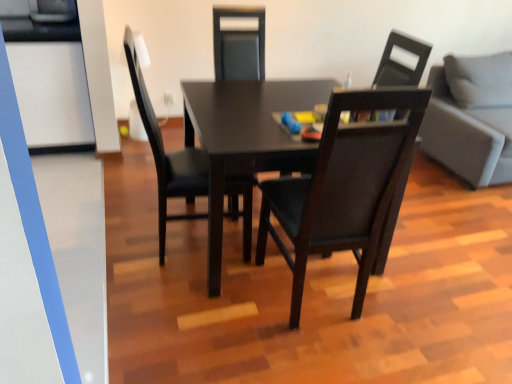
Question: Is matte black table at center inside the boundaries of matte black chair at center, the first chair in the right-to-left sequence, or outside?

Choices:
 (A) outside
 (B) inside

Answer: (A)

Question: Is matte black table at center in front of or behind matte black chair at center, the first chair in the right-to-left sequence, in the image?

Choices:
 (A) behind
 (B) front

Answer: (B)

Question: Considering the real-world distances, which object is farthest from the gray fabric couch at right?

Choices:
 (A) matte black chair at center, which is the third chair from right to left
 (B) transparent glass door at left
 (C) matte black table at center
 (D) matte black chair at center, the first chair in the right-to-left sequence
 (E) matte black chair at center, the 2th chair in the left-to-right sequence

Answer: (B)

Question: Based on their relative distances, which object is nearer to the matte black chair at center, the first chair in the right-to-left sequence?

Choices:
 (A) transparent glass door at left
 (B) matte black chair at center, the 2th chair in the left-to-right sequence
 (C) gray fabric couch at right
 (D) matte black table at center
 (E) matte black chair at center, arranged as the first chair when viewed from the left

Answer: (D)